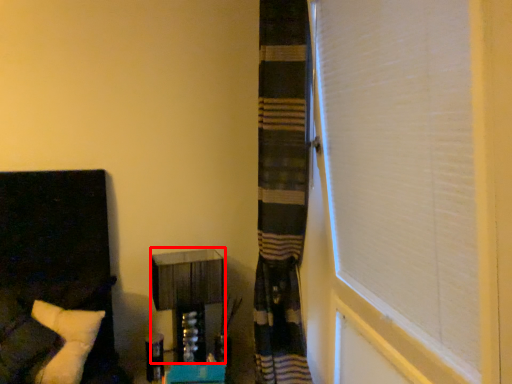
Question: From the image's perspective, where is vanity (annotated by the red box) located relative to furniture?

Choices:
 (A) below
 (B) above

Answer: (A)